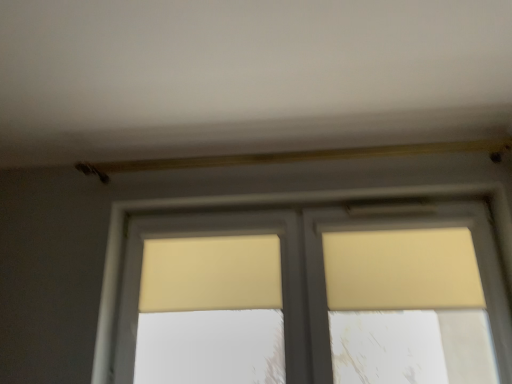
Question: Which direction should I rotate to face beige fabric curtain at center, the 2th curtain positioned from the right, — up or down?

Choices:
 (A) down
 (B) up

Answer: (A)

Question: From the image's perspective, does beige fabric curtain at upper right, the 2th curtain from the left, appear lower than matte yellow window at center?

Choices:
 (A) yes
 (B) no

Answer: (B)

Question: Is beige fabric curtain at upper right, the 2th curtain from the left, directly adjacent to matte yellow window at center?

Choices:
 (A) yes
 (B) no

Answer: (B)

Question: From the image's perspective, would you say beige fabric curtain at upper right, the 2th curtain from the left, is positioned over matte yellow window at center?

Choices:
 (A) yes
 (B) no

Answer: (A)

Question: Is beige fabric curtain at upper right, which is counted as the first curtain, starting from the right, not close to matte yellow window at center?

Choices:
 (A) yes
 (B) no

Answer: (B)

Question: Can you confirm if beige fabric curtain at upper right, the 2th curtain from the left, is bigger than matte yellow window at center?

Choices:
 (A) no
 (B) yes

Answer: (A)

Question: Does beige fabric curtain at upper right, which is counted as the first curtain, starting from the right, come in front of matte yellow window at center?

Choices:
 (A) yes
 (B) no

Answer: (B)

Question: Can you confirm if matte yellow window at center is taller than beige fabric curtain at center, the 2th curtain positioned from the right?

Choices:
 (A) yes
 (B) no

Answer: (A)

Question: Does matte yellow window at center appear on the right side of beige fabric curtain at center, arranged as the 1th curtain when viewed from the left?

Choices:
 (A) no
 (B) yes

Answer: (B)

Question: Does matte yellow window at center have a smaller size compared to beige fabric curtain at center, the 2th curtain positioned from the right?

Choices:
 (A) no
 (B) yes

Answer: (A)

Question: Is matte yellow window at center shorter than beige fabric curtain at center, the 2th curtain positioned from the right?

Choices:
 (A) no
 (B) yes

Answer: (A)

Question: Is the depth of matte yellow window at center greater than that of beige fabric curtain at center, arranged as the 1th curtain when viewed from the left?

Choices:
 (A) yes
 (B) no

Answer: (B)

Question: Considering the relative positions of matte yellow window at center and beige fabric curtain at center, the 2th curtain positioned from the right, in the image provided, is matte yellow window at center to the left of beige fabric curtain at center, the 2th curtain positioned from the right, from the viewer's perspective?

Choices:
 (A) no
 (B) yes

Answer: (A)

Question: Is beige fabric curtain at upper right, which is counted as the first curtain, starting from the right, next to beige fabric curtain at center, arranged as the 1th curtain when viewed from the left?

Choices:
 (A) yes
 (B) no

Answer: (B)